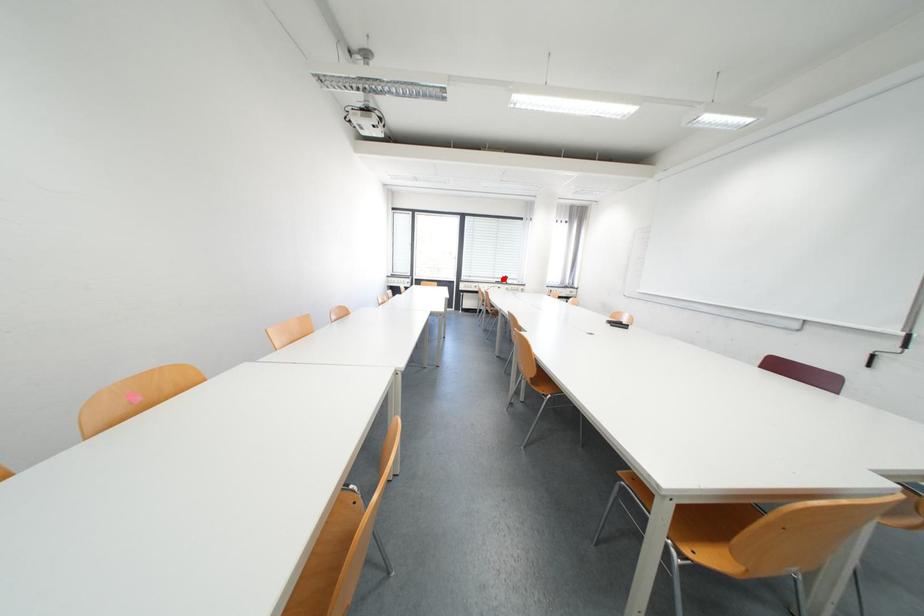
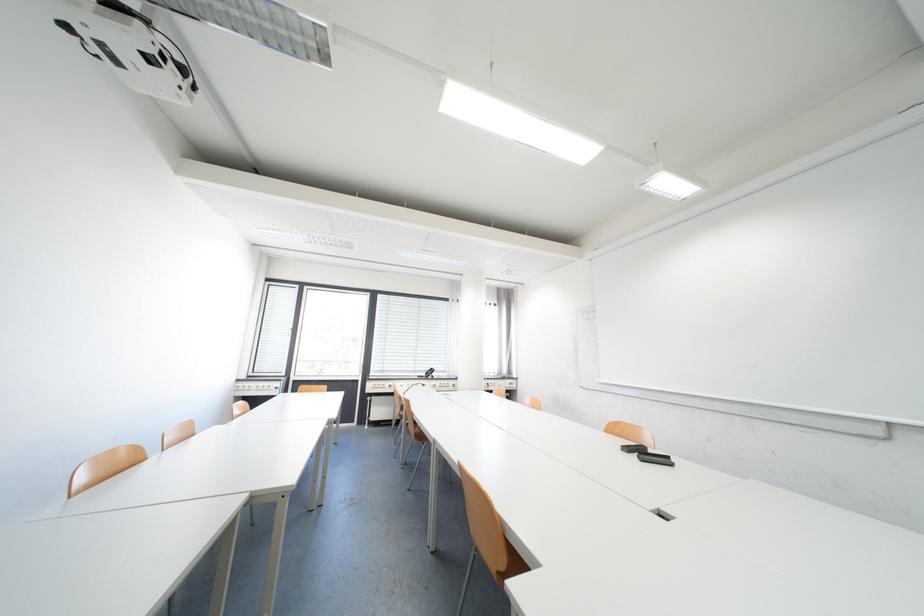
In the second image, find the point that corresponds to the highlighted location in the first image.

(426, 371)